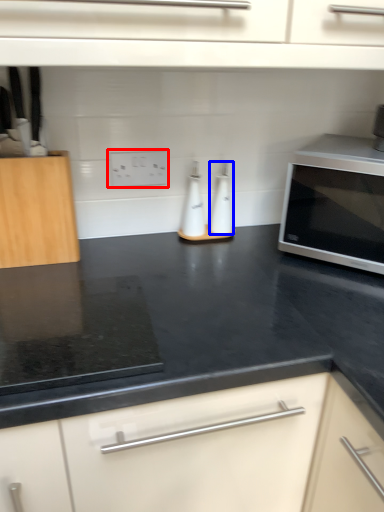
Question: Which of the following is the farthest to the observer, electric outlet (highlighted by a red box) or bottle (highlighted by a blue box)?

Choices:
 (A) electric outlet
 (B) bottle

Answer: (B)